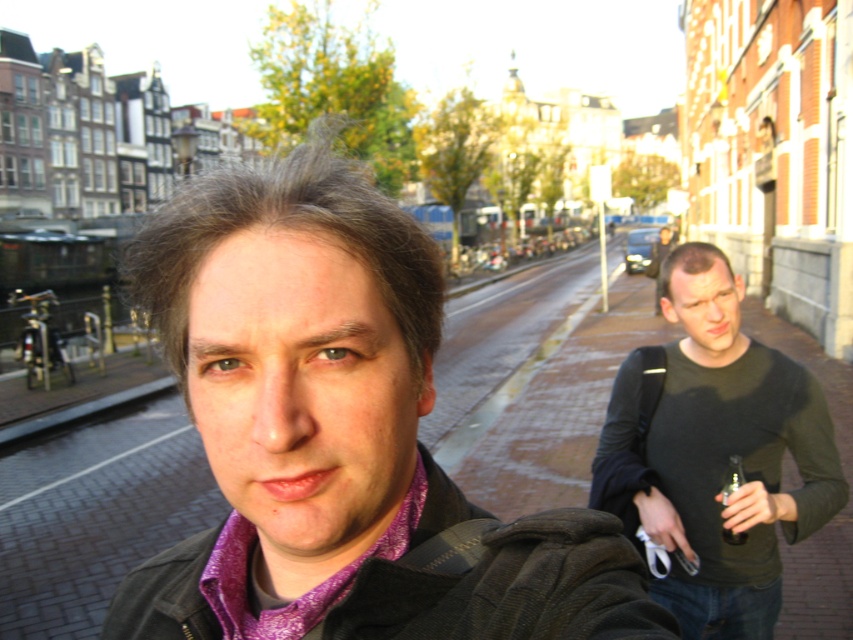
You are standing at the center of the image and want to hand a brochure to the person wearing the dark green sweater at right. In which direction should you move to approach them?

The dark green sweater at right is located at point 0.711 on the x and 0.842 on the y coordinates. Since the x coordinate is 0.711, which is to the right of the center point at 0.5, you should move to the right to reach them.

You are a photographer trying to capture both the purple patterned scarf at center and the clear plastic bottle at center in the same frame. Which object should you adjust your camera to focus on first if you want to ensure both are in focus, considering their sizes?

Since the purple patterned scarf at center is wider than the clear plastic bottle at center, you should focus on the purple patterned scarf at center first to ensure both are in focus, as larger objects require a closer focus point for depth of field.